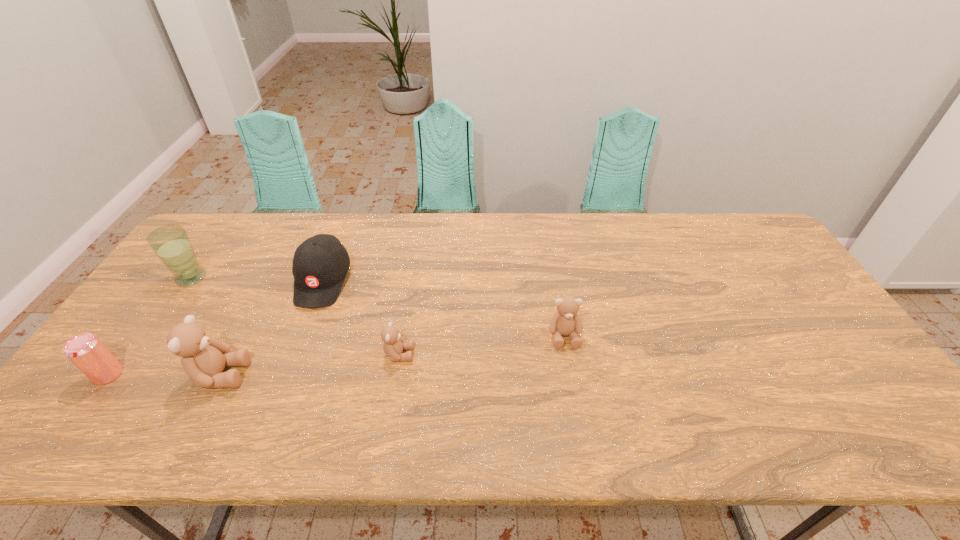
Where is `free space between the second teddy bear from left to right and the rightmost teddy bear`? The width and height of the screenshot is (960, 540). free space between the second teddy bear from left to right and the rightmost teddy bear is located at coordinates point(482,345).

This screenshot has height=540, width=960. Find the location of `unoccupied area between the glass and the shortest teddy bear`. unoccupied area between the glass and the shortest teddy bear is located at coordinates (295, 316).

You are a GUI agent. You are given a task and a screenshot of the screen. Output one action in this format:
    pyautogui.click(x=<x>, y=<y>)
    Task: Click on the free space between the shortest object and the rightmost object
    This screenshot has height=540, width=960.
    Given the screenshot: What is the action you would take?
    [x=482, y=345]

You are a GUI agent. You are given a task and a screenshot of the screen. Output one action in this format:
    pyautogui.click(x=<x>, y=<y>)
    Task: Click on the unoccupied position between the baseball cap and the second shortest teddy bear
    The width and height of the screenshot is (960, 540).
    Given the screenshot: What is the action you would take?
    pyautogui.click(x=444, y=308)

Identify the location of free space between the third object from right to left and the leftmost teddy bear. (272, 328).

Find the location of a particular element. The image size is (960, 540). object that is the fourth nearest to the fourth object from left to right is located at coordinates (85, 350).

Identify which object is the fifth closest to the baseball cap. Please provide its 2D coordinates. Your answer should be formatted as a tuple, i.e. [(x, y)], where the tuple contains the x and y coordinates of a point satisfying the conditions above.

[(565, 321)]

I want to click on the closest teddy bear to the fourth object from right to left, so click(x=393, y=346).

Identify the location of teddy bear identified as the second closest to the rightmost object. (203, 359).

Locate an element on the screen. This screenshot has height=540, width=960. free spot that satisfies the following two spatial constraints: 1. on the front-facing side of the second tallest teddy bear; 2. on the front-facing side of the shortest object is located at coordinates (567, 354).